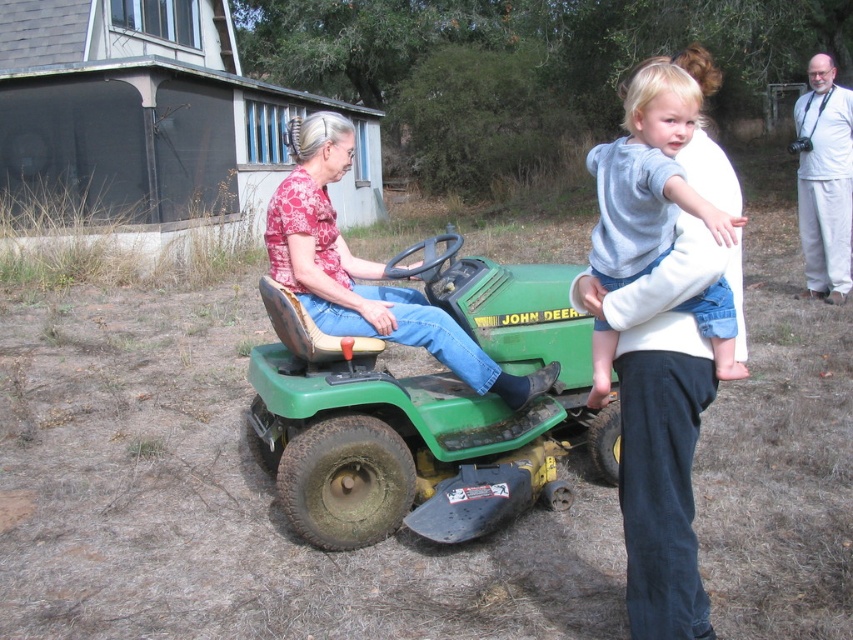
Is green rubber tractor at center taller than light gray fleece shirt at upper right?

Correct, green rubber tractor at center is much taller as light gray fleece shirt at upper right.

Between point (282, 401) and point (694, 307), which one is positioned in front?

Point (694, 307)

Describe the element at coordinates (422, 410) in the screenshot. I see `green rubber tractor at center` at that location.

Locate an element on the screen. green rubber tractor at center is located at coordinates (422, 410).

You are a GUI agent. You are given a task and a screenshot of the screen. Output one action in this format:
    pyautogui.click(x=<x>, y=<y>)
    Task: Click on the green rubber tractor at center
    
    Given the screenshot: What is the action you would take?
    pyautogui.click(x=422, y=410)

Does green rubber tractor at center appear under matte pink shirt at center?

Yes, green rubber tractor at center is below matte pink shirt at center.

This screenshot has height=640, width=853. What do you see at coordinates (422, 410) in the screenshot?
I see `green rubber tractor at center` at bounding box center [422, 410].

You are a GUI agent. You are given a task and a screenshot of the screen. Output one action in this format:
    pyautogui.click(x=<x>, y=<y>)
    Task: Click on the green rubber tractor at center
    The image size is (853, 640).
    Given the screenshot: What is the action you would take?
    (422, 410)

Between light gray fleece shirt at upper right and matte pink shirt at center, which one appears on the right side from the viewer's perspective?

From the viewer's perspective, light gray fleece shirt at upper right appears more on the right side.

Is light gray fleece shirt at upper right smaller than matte pink shirt at center?

Yes.

Is point (624, 104) in front of point (445, 324)?

No.

At what (x,y) coordinates should I click in order to perform the action: click on light gray fleece shirt at upper right. Please return your answer as a coordinate pair (x, y). This screenshot has width=853, height=640. Looking at the image, I should click on (648, 177).